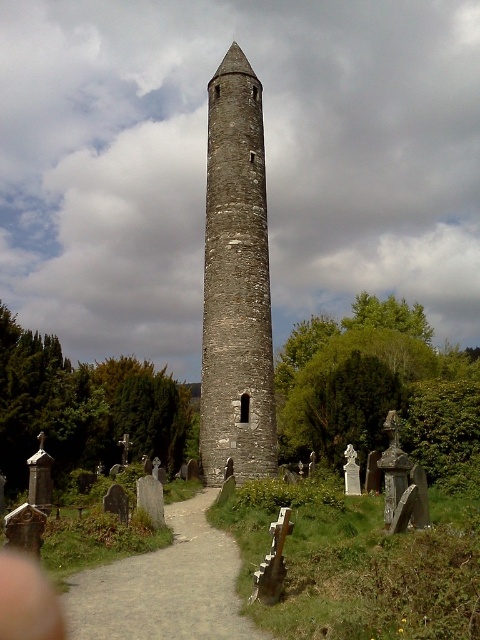
Question: Can you confirm if gray stone tower at center is bigger than dirt/gravel path at center?

Choices:
 (A) yes
 (B) no

Answer: (A)

Question: Is gray stone tower at center above dirt/gravel path at center?

Choices:
 (A) no
 (B) yes

Answer: (B)

Question: Is gray stone tower at center wider than dirt/gravel path at center?

Choices:
 (A) yes
 (B) no

Answer: (B)

Question: Among these objects, which one is nearest to the camera?

Choices:
 (A) dirt/gravel path at center
 (B) gray stone tower at center

Answer: (A)